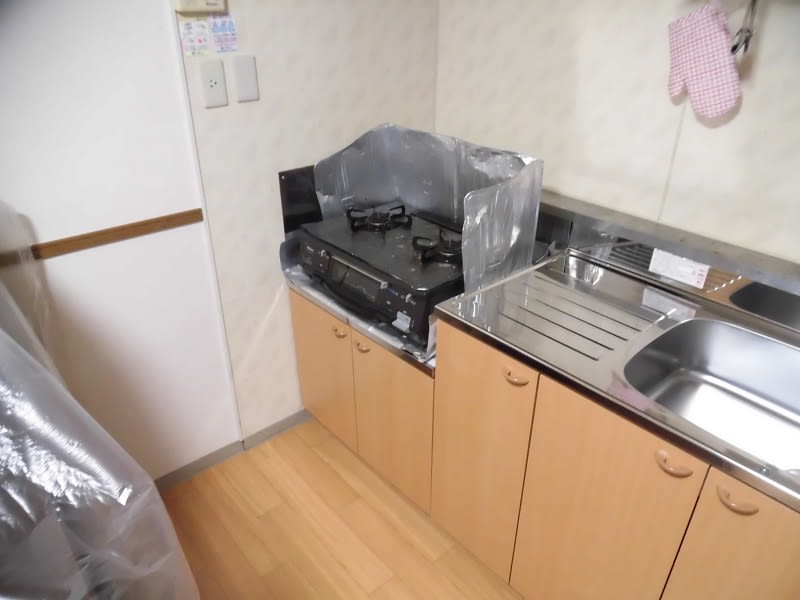
The height and width of the screenshot is (600, 800). Find the location of `hardwood floor`. hardwood floor is located at coordinates (260, 545).